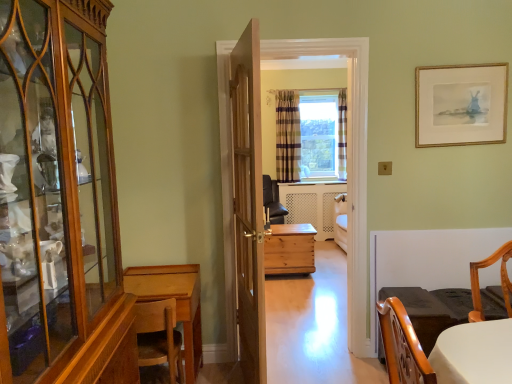
The height and width of the screenshot is (384, 512). Identify the location of wooden chair at lower left. (159, 337).

Locate an element on the screen. This screenshot has width=512, height=384. plaid fabric curtain at center, the first curtain viewed from the left is located at coordinates (288, 136).

Measure the distance between point (344,151) and camera.

They are 6.33 meters apart.

This screenshot has height=384, width=512. I want to click on plaid fabric curtain at center, placed as the 1th curtain when sorted from right to left, so click(342, 134).

I want to click on wooden desk at lower left, arranged as the second desk when viewed from the back, so click(176, 302).

Find the location of a particular element. The image size is (512, 384). white glossy table at lower right is located at coordinates (432, 310).

This screenshot has height=384, width=512. I want to click on wooden door at center, so click(248, 203).

The image size is (512, 384). Find the location of `wooden chest at center`. wooden chest at center is located at coordinates (261, 167).

Can you tell me how much wooden picture frame at upper right and wooden cabinet at left differ in facing direction?

The angular difference between wooden picture frame at upper right and wooden cabinet at left is 92 degrees.

Measure the distance between wooden picture frame at upper right and wooden cabinet at left.

wooden picture frame at upper right is 6.84 feet away from wooden cabinet at left.

Between wooden picture frame at upper right and wooden cabinet at left, which one has larger size?

With larger size is wooden cabinet at left.

Does point (497, 67) come closer to viewer compared to point (36, 218)?

No, it is not.

Is wooden chest at center positioned with its back to wooden picture frame at upper right?

No, wooden chest at center is not facing away from wooden picture frame at upper right.

Which is behind, wooden chest at center or wooden picture frame at upper right?

wooden picture frame at upper right is further from the camera.

Does wooden chest at center have a greater height compared to wooden picture frame at upper right?

Yes, wooden chest at center is taller than wooden picture frame at upper right.

Is wooden picture frame at upper right completely or partially inside wooden chest at center?

Definitely not — wooden picture frame at upper right is not inside wooden chest at center.

Between point (278, 129) and point (305, 144), which one is positioned in front?

Point (278, 129)

From the image's perspective, who appears lower, plaid fabric curtain at center, the first curtain viewed from the left, or clear glass window at center?

plaid fabric curtain at center, the first curtain viewed from the left, from the image's perspective.

Considering the relative sizes of plaid fabric curtain at center, the first curtain viewed from the left, and clear glass window at center in the image provided, is plaid fabric curtain at center, the first curtain viewed from the left, shorter than clear glass window at center?

Yes, plaid fabric curtain at center, the first curtain viewed from the left, is shorter than clear glass window at center.

Who is bigger, wooden chest at center or plaid fabric curtain at center, which is counted as the 2th curtain, starting from the left?

With larger size is wooden chest at center.

Do you think wooden chest at center is within plaid fabric curtain at center, placed as the 1th curtain when sorted from right to left, or outside of it?

The correct answer is: outside.

Is wooden chest at center oriented away from plaid fabric curtain at center, which is counted as the 2th curtain, starting from the left?

That's not correct — wooden chest at center is not looking away from plaid fabric curtain at center, which is counted as the 2th curtain, starting from the left.

Would you consider wooden chest at center to be distant from plaid fabric curtain at center, placed as the 1th curtain when sorted from right to left?

Indeed, wooden chest at center is not near plaid fabric curtain at center, placed as the 1th curtain when sorted from right to left.

From a real-world perspective, who is located higher, wooden chair at lower left or natural wood chest at center, which appears as the second desk when viewed from the left?

wooden chair at lower left, from a real-world perspective.

Is natural wood chest at center, which ranks as the 1th desk in back-to-front order, surrounded by wooden chair at lower left?

Actually, natural wood chest at center, which ranks as the 1th desk in back-to-front order, is outside wooden chair at lower left.

Which is less distant, (165, 362) or (265, 269)?

Positioned in front is point (165, 362).

This screenshot has height=384, width=512. What are the coordinates of `door on the left of plaid fabric curtain at center, positioned as the second curtain in right-to-left order` in the screenshot? It's located at (248, 203).

Can you see plaid fabric curtain at center, the first curtain viewed from the left, touching wooden door at center?

No, plaid fabric curtain at center, the first curtain viewed from the left, is not beside wooden door at center.

Between point (289, 155) and point (238, 284), which one is positioned in front?

Positioned in front is point (238, 284).

Can you tell me how much plaid fabric curtain at center, positioned as the second curtain in right-to-left order, and wooden door at center differ in facing direction?

They differ by 97.5 degrees in their facing directions.

From a real-world perspective, is wooden picture frame at upper right physically above wooden chest at center?

Indeed, from a real-world perspective, wooden picture frame at upper right stands above wooden chest at center.

Can you confirm if wooden picture frame at upper right is taller than wooden chest at center?

No, wooden picture frame at upper right is not taller than wooden chest at center.

Considering the points (451, 90) and (321, 47), which point is behind, point (451, 90) or point (321, 47)?

Positioned behind is point (451, 90).

Identify the location of cabinetry in front of the wooden picture frame at upper right. (59, 200).

Locate an element on the screen. corridor on the left of wooden picture frame at upper right is located at coordinates (261, 167).

Based on their spatial positions, is plaid fabric curtain at center, positioned as the second curtain in right-to-left order, or wooden chest at center closer to wooden picture frame at upper right?

The object closer to wooden picture frame at upper right is wooden chest at center.

Looking at the image, which one is located closer to wooden desk at lower left, which is the first desk from front to back, white glossy table at lower right or natural wood chest at center, which appears as the second desk when viewed from the left?

The object closer to wooden desk at lower left, which is the first desk from front to back, is white glossy table at lower right.

Which object lies nearer to the anchor point natural wood chest at center, which appears as the 2th desk when viewed from the front, wooden cabinet at left or wooden picture frame at upper right?

wooden picture frame at upper right is closer to natural wood chest at center, which appears as the 2th desk when viewed from the front.

In the scene shown: Which object lies further to the anchor point wooden desk at lower left, arranged as the second desk when viewed from the back, wooden chair at lower left or white glossy table at lower right?

white glossy table at lower right is positioned further to the anchor wooden desk at lower left, arranged as the second desk when viewed from the back.

Based on the photo, based on their spatial positions, is wooden picture frame at upper right or white glossy table at lower right further from wooden cabinet at left?

wooden picture frame at upper right.

From the image, which object appears to be farther from clear glass window at center, wooden door at center or plaid fabric curtain at center, placed as the 1th curtain when sorted from right to left?

Based on the image, wooden door at center appears to be further to clear glass window at center.

Looking at the image, which one is located closer to white glossy table at lower right, natural wood chest at center, which appears as the second desk when viewed from the left, or wooden picture frame at upper right?

Among the two, wooden picture frame at upper right is located nearer to white glossy table at lower right.

Looking at the image, which one is located further to wooden chair at lower left, plaid fabric curtain at center, positioned as the second curtain in right-to-left order, or natural wood chest at center, which appears as the 2th desk when viewed from the front?

The object further to wooden chair at lower left is plaid fabric curtain at center, positioned as the second curtain in right-to-left order.

Where is `desk between wooden desk at lower left, arranged as the second desk when viewed from the back, and plaid fabric curtain at center, the first curtain viewed from the left, from front to back`? This screenshot has width=512, height=384. desk between wooden desk at lower left, arranged as the second desk when viewed from the back, and plaid fabric curtain at center, the first curtain viewed from the left, from front to back is located at coordinates (290, 249).

Where is `corridor between wooden chair at lower left and plaid fabric curtain at center, placed as the 1th curtain when sorted from right to left, along the z-axis`? corridor between wooden chair at lower left and plaid fabric curtain at center, placed as the 1th curtain when sorted from right to left, along the z-axis is located at coordinates (261, 167).

The width and height of the screenshot is (512, 384). I want to click on table between wooden door at center and plaid fabric curtain at center, which is counted as the 2th curtain, starting from the left, from front to back, so click(x=432, y=310).

You are a GUI agent. You are given a task and a screenshot of the screen. Output one action in this format:
    pyautogui.click(x=<x>, y=<y>)
    Task: Click on the chair between wooden cabinet at left and white glossy table at lower right
    The image size is (512, 384).
    Given the screenshot: What is the action you would take?
    pyautogui.click(x=159, y=337)